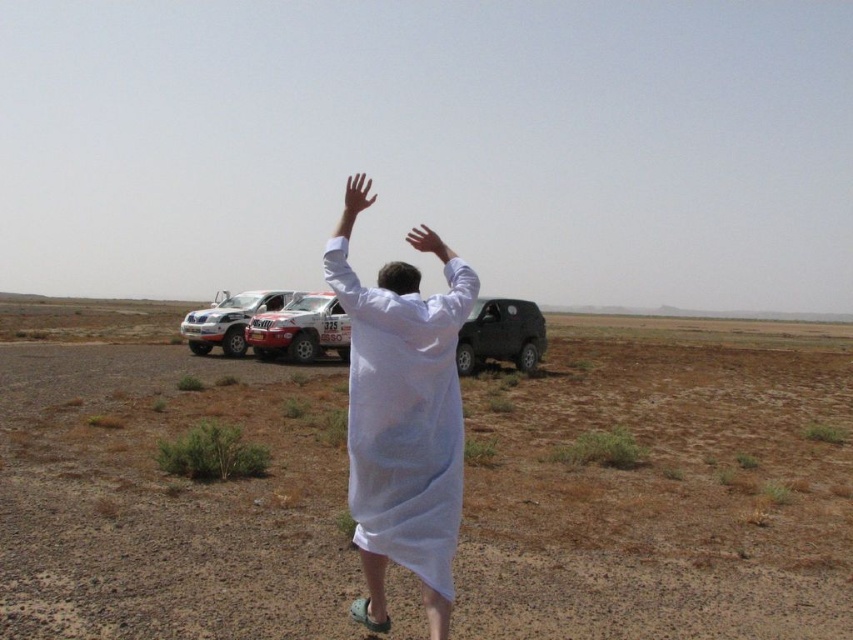
Question: Among these points, which one is farthest from the camera?

Choices:
 (A) (x=227, y=330)
 (B) (x=450, y=310)
 (C) (x=350, y=184)
 (D) (x=68, y=429)

Answer: (A)

Question: Does white cloth at center lie in front of matte red car at center?

Choices:
 (A) yes
 (B) no

Answer: (A)

Question: Does brown sandy dirt field at center appear under matte black suv at center?

Choices:
 (A) no
 (B) yes

Answer: (B)

Question: Which of the following is the closest to the observer?

Choices:
 (A) (142, 532)
 (B) (251, 308)

Answer: (A)

Question: Does white cloth at center appear on the right side of matte black suv at center?

Choices:
 (A) yes
 (B) no

Answer: (B)

Question: Which is farther from the matte red car at center?

Choices:
 (A) brown sandy dirt field at center
 (B) matte black suv at center
 (C) white cloth at center
 (D) white matte suv at center

Answer: (C)